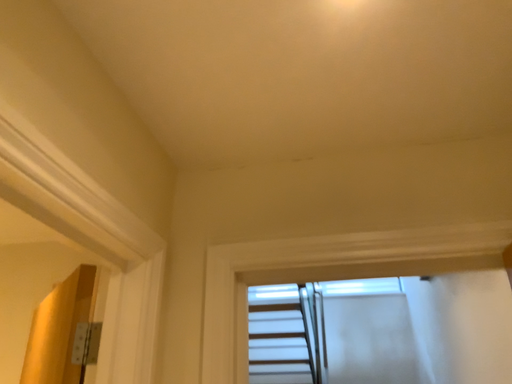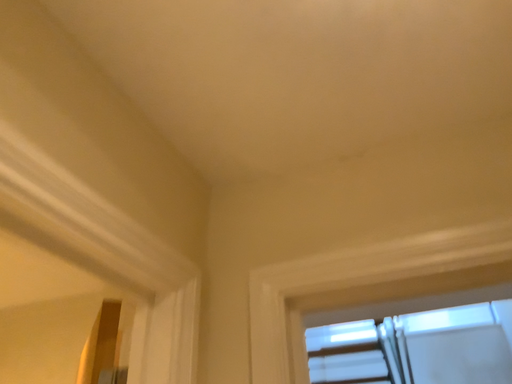
Question: Which way did the camera rotate in the video?

Choices:
 (A) rotated left
 (B) rotated right

Answer: (A)